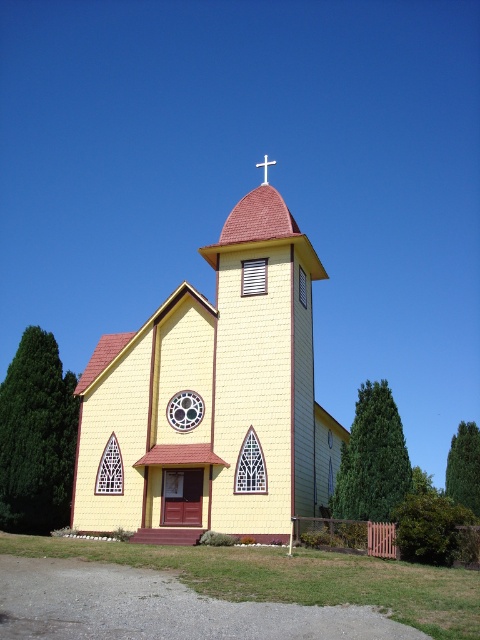
Question: Is yellow wood chapel at center positioned in front of white metallic cross at upper center?

Choices:
 (A) no
 (B) yes

Answer: (B)

Question: Can you confirm if yellow wood chapel at center is positioned above metallic circular clock at center?

Choices:
 (A) yes
 (B) no

Answer: (A)

Question: Which object appears farthest from the camera in this image?

Choices:
 (A) white metallic cross at upper center
 (B) metallic circular clock at center

Answer: (A)

Question: Which object is farther from the camera taking this photo?

Choices:
 (A) metallic circular clock at center
 (B) yellow wood chapel at center
 (C) white metallic cross at upper center

Answer: (C)

Question: Does yellow wood chapel at center appear over metallic circular clock at center?

Choices:
 (A) no
 (B) yes

Answer: (B)

Question: Which point is farther to the camera?

Choices:
 (A) metallic circular clock at center
 (B) white metallic cross at upper center
 (C) yellow wood chapel at center

Answer: (B)